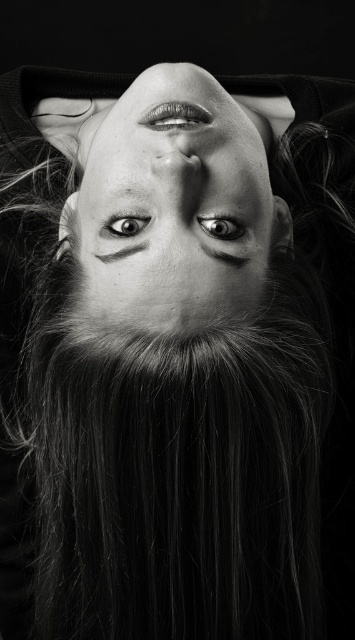
Question: Is smooth skin face at center above shiny black eye at center?

Choices:
 (A) yes
 (B) no

Answer: (A)

Question: Does smooth skin face at center appear over shiny black eye at center?

Choices:
 (A) no
 (B) yes

Answer: (B)

Question: Which is farther from the shiny silver eye at center?

Choices:
 (A) smooth skin face at center
 (B) shiny black eye at center

Answer: (A)

Question: Which of these objects is positioned closest to the shiny silver eye at center?

Choices:
 (A) smooth skin face at center
 (B) shiny black eye at center

Answer: (B)

Question: Can you confirm if smooth skin face at center is positioned to the left of shiny black eye at center?

Choices:
 (A) yes
 (B) no

Answer: (A)

Question: Which of these objects is positioned farthest from the smooth skin face at center?

Choices:
 (A) shiny silver eye at center
 (B) shiny black eye at center

Answer: (B)